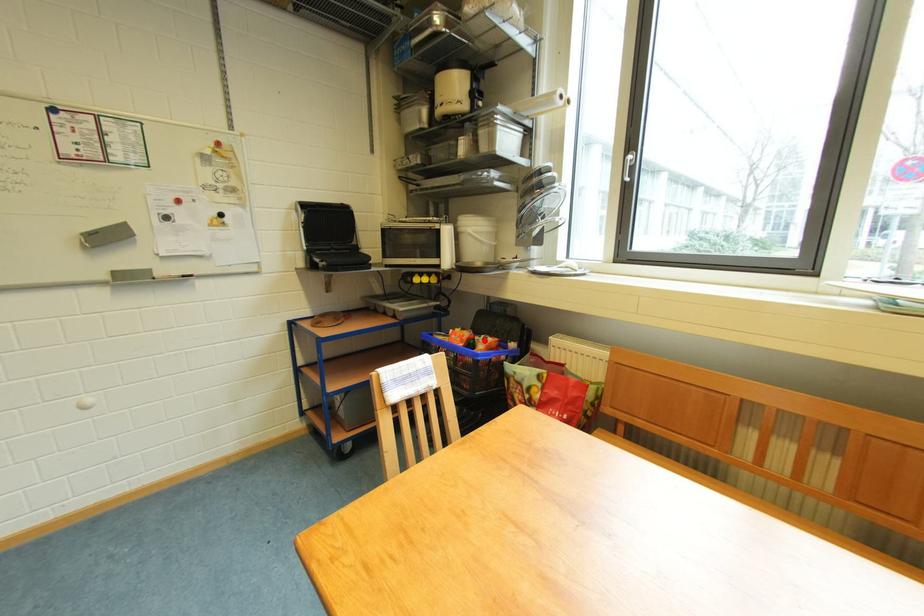
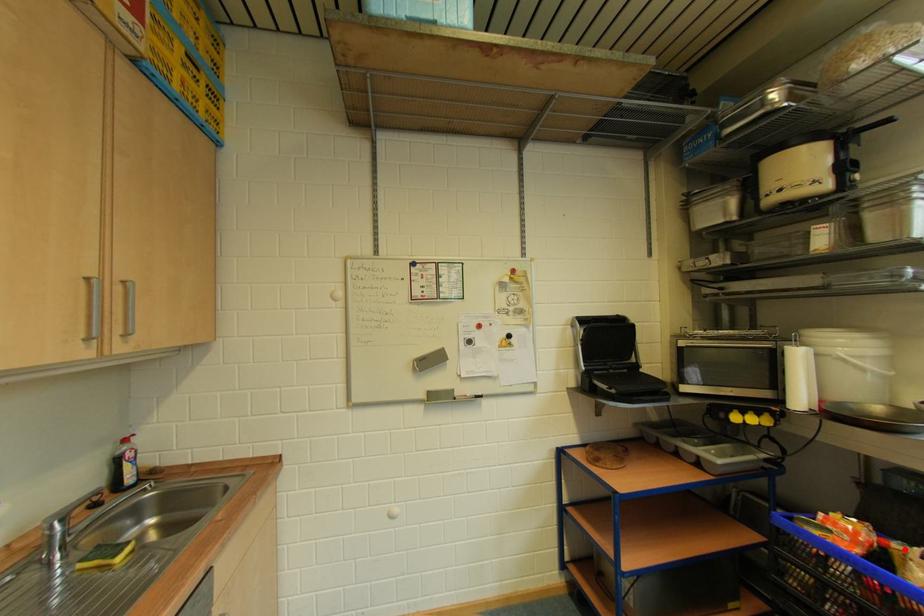
I am providing you with two images of the same scene from different viewpoints. A red point is marked on the first image and another point is marked on the second image. Is the red point in image1 aligned with the point shown in image2?

Yes